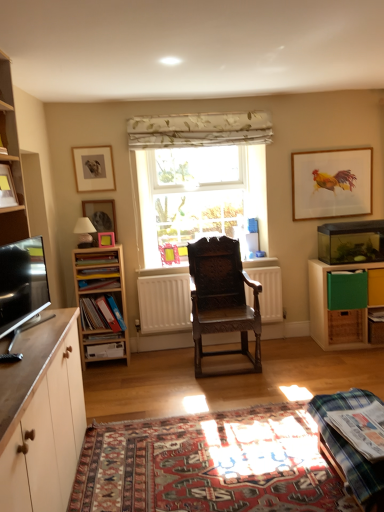
Identify the location of free space above plaid fabric book at lower right, which is counted as the 5th book, starting from the back (from a real-world perspective). The height and width of the screenshot is (512, 384). (371, 419).